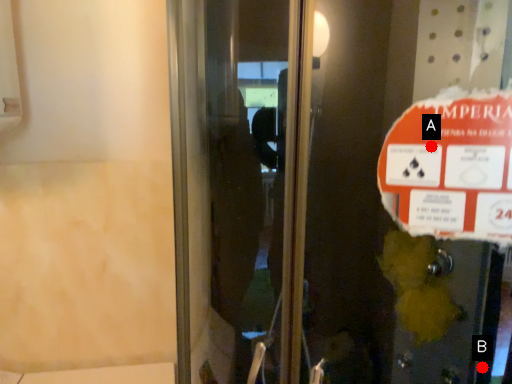
Question: Two points are circled on the image, labeled by A and B beside each circle. Which point appears farthest from the camera in this image?

Choices:
 (A) A is further
 (B) B is further

Answer: (B)